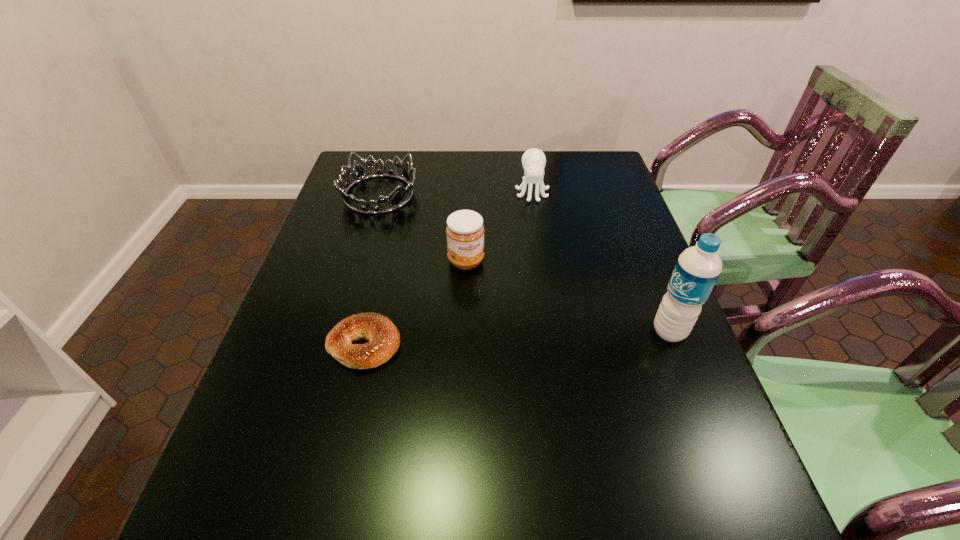
At what (x,y) coordinates should I click in order to perform the action: click on octopus present at the far edge. Please return your answer as a coordinate pair (x, y). Looking at the image, I should click on (533, 160).

The width and height of the screenshot is (960, 540). What are the coordinates of `tiara at the far edge` in the screenshot? It's located at pyautogui.click(x=359, y=173).

In order to click on bagel located in the left edge section of the desktop in this screenshot , I will do `click(384, 339)`.

This screenshot has height=540, width=960. I want to click on tiara present at the left edge, so click(359, 173).

Locate an element on the screen. object that is at the right edge is located at coordinates (698, 268).

Find the location of a particular element. object that is at the far left corner is located at coordinates click(359, 173).

This screenshot has height=540, width=960. What are the coordinates of `vacant area at the far edge of the desktop` in the screenshot? It's located at (446, 163).

At what (x,y) coordinates should I click in order to perform the action: click on vacant space at the near edge. Please return your answer as a coordinate pair (x, y). Image resolution: width=960 pixels, height=540 pixels. Looking at the image, I should click on (589, 469).

Where is `vacant region at the left edge of the desktop`? vacant region at the left edge of the desktop is located at coordinates (286, 326).

Locate an element on the screen. Image resolution: width=960 pixels, height=540 pixels. free space at the right edge of the desktop is located at coordinates (631, 252).